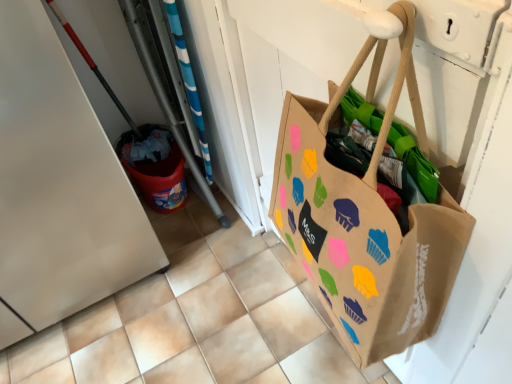
This screenshot has width=512, height=384. What do you see at coordinates (366, 215) in the screenshot? I see `brown paper bag at right` at bounding box center [366, 215].

Find the location of a particular element. This screenshot has height=384, width=512. brown paper bag at right is located at coordinates (366, 215).

Where is `brown paper bag at right`? brown paper bag at right is located at coordinates (366, 215).